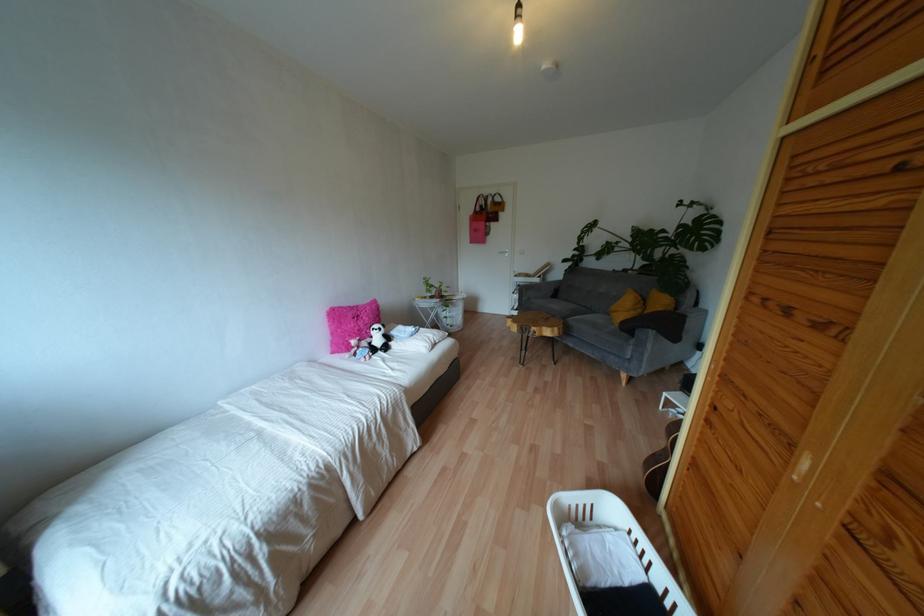
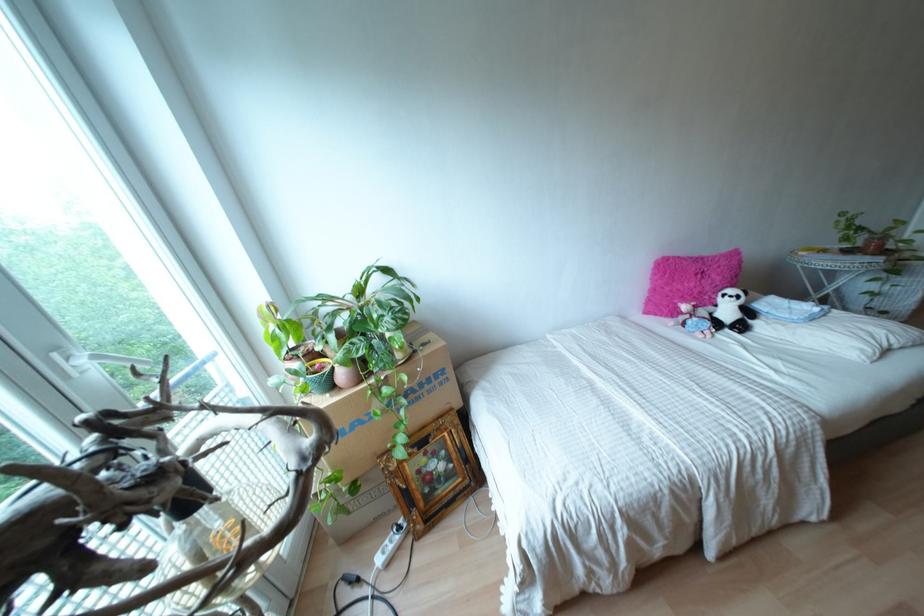
Find the pixel in the second image that matches (393,331) in the first image.

(759, 305)